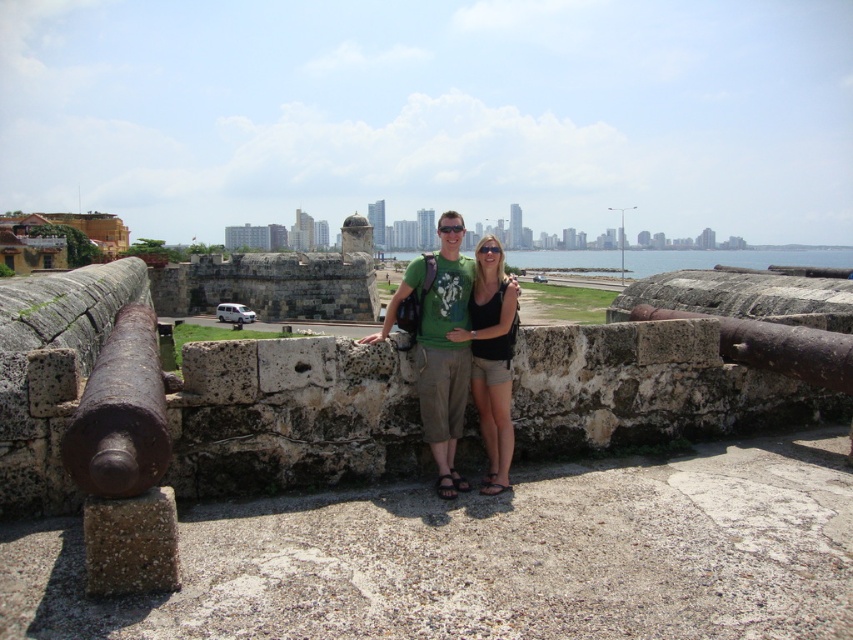
You are standing at the point marked as point [107,483] in the image, which is part of a historic stone wall with cannons. You want to take a photo of the cannons using a camera that has a maximum range of 15 meters. Can the camera capture the cannons from your current position?

The distance between point [107,483] and the camera is 17.10 meters, which exceeds the camera maximum range of 15 meters. Therefore, the camera cannot capture the cannons from your current position.